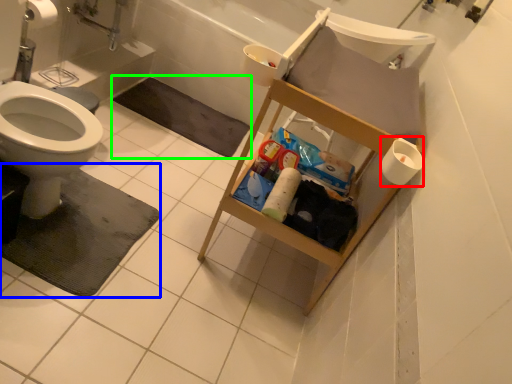
Question: Based on their relative distances, which object is nearer to toilet paper (highlighted by a red box)? Choose from bath mat (highlighted by a blue box) and bath mat (highlighted by a green box).

Choices:
 (A) bath mat
 (B) bath mat

Answer: (A)